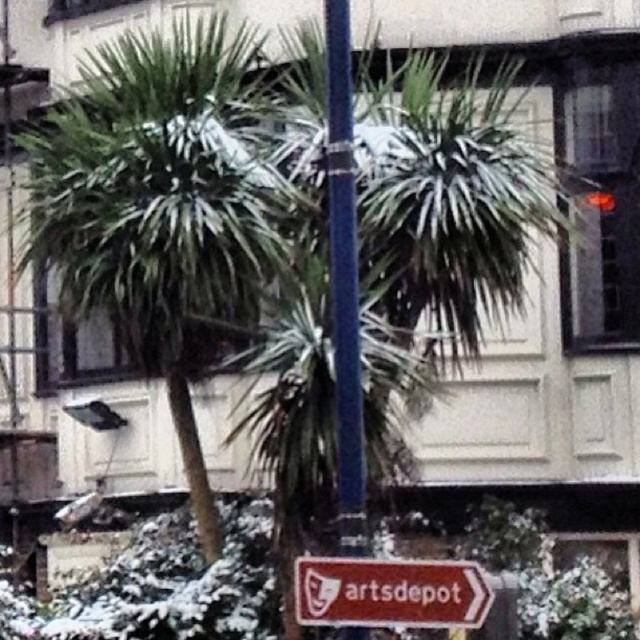
You are standing in front of the green leafy palm tree at center and the smooth blue pole at center. Which object is larger in size?

The green leafy palm tree at center is bigger than the smooth blue pole at center according to the description.

You are standing at the point marked by the coordinates point (x=163, y=209) in the image. Looking around, you see a green leafy palm tree at center. What is directly in front of you?

The point (x=163, y=209) marks the green leafy palm tree at center, so you are standing at the location of the green leafy palm tree at center. Therefore, the tree itself is directly in front of you.